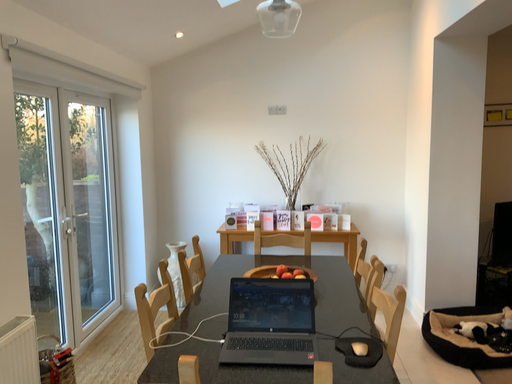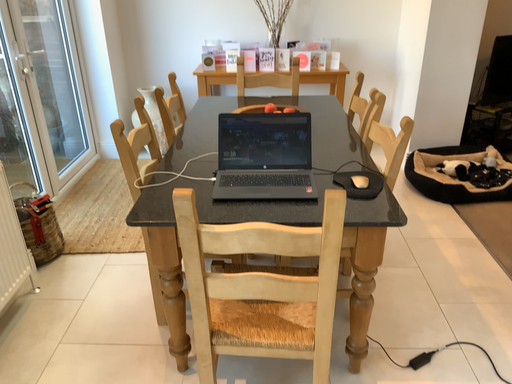
Question: Which way did the camera rotate in the video?

Choices:
 (A) rotated downward
 (B) rotated upward

Answer: (A)